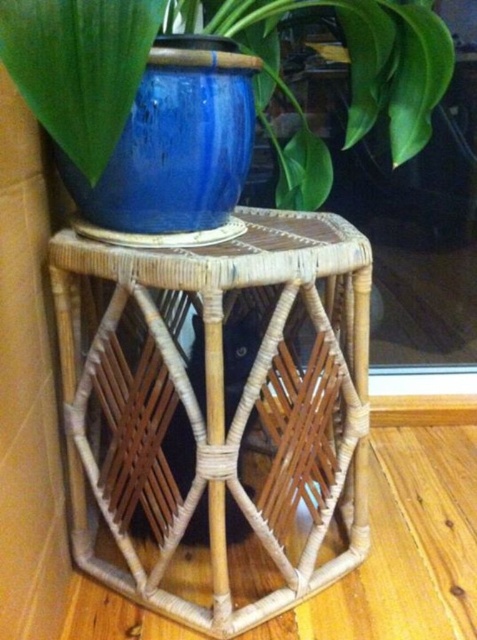
From the picture: You are arranging a small plant in the blue ceramic pot at upper center. You want to place it on the natural woven table at center so that it doesn

The natural woven table at center is wider than the blue ceramic pot at upper center, so placing the pot in the center of the table would ensure it is stable and centered.

You are arranging flowers in a living room and have two blue ceramic items on the table. You need to place a bouquet that requires 10 inches of space between them. Can you fit the bouquet between the blue ceramic pot at upper center and the blue ceramic vase at center?

The blue ceramic pot at upper center and blue ceramic vase at center are 8.49 inches apart from each other, which is less than the required 10 inches. Therefore, the bouquet cannot be placed between them with the needed space.